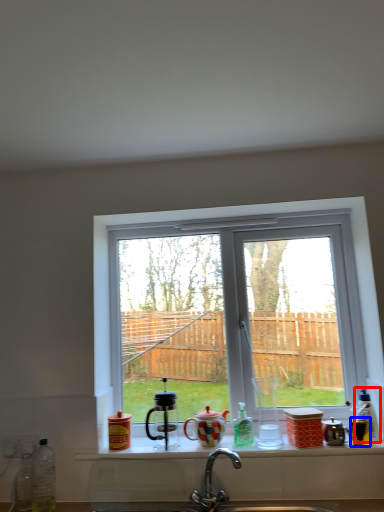
Question: Which point is closer to the camera, bottle (highlighted by a red box) or appliance (highlighted by a blue box)?

Choices:
 (A) bottle
 (B) appliance

Answer: (B)